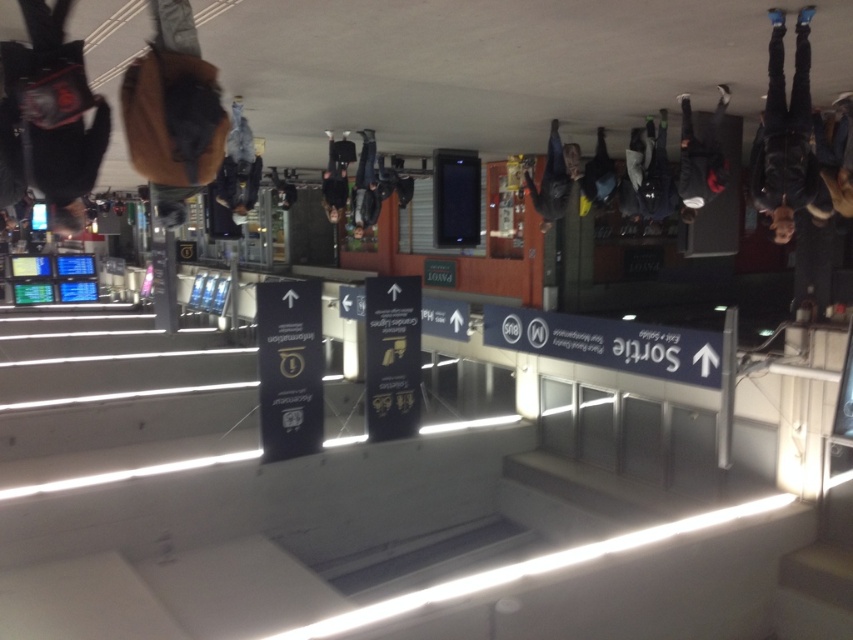
You are a traveler carrying both the matte black backpack at center and the matte black bag at center. You need to place them side by side on a shelf that can only accommodate items up to the width of the wider object. Which item should you use as the reference for the shelf width requirement?

The matte black backpack at center is wider than the matte black bag at center. Therefore, the shelf must be at least as wide as the matte black backpack at center to accommodate both items.

You are a traveler in an upside down train station. You see a dark gray fabric bag at upper center and dark blue jeans at upper right. Which item is closer to the ceiling?

The dark gray fabric bag at upper center is located above the dark blue jeans at upper right, so it is closer to the ceiling in the upside down station.